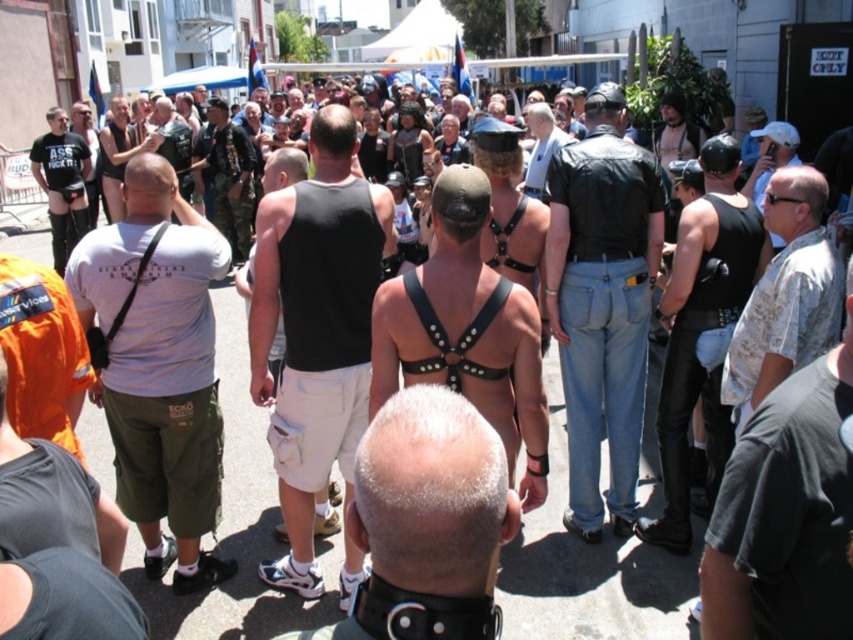
Question: Is gray cotton t-shirt at center bigger than camouflage jacket at center?

Choices:
 (A) yes
 (B) no

Answer: (B)

Question: Which is farther from the black matte tank top at center?

Choices:
 (A) leather harness at center
 (B) camouflage jacket at center

Answer: (B)

Question: Is white cotton t-shirt at center closer to the viewer compared to white textured shirt at center?

Choices:
 (A) no
 (B) yes

Answer: (A)

Question: Which object is the closest to the leather harness at center?

Choices:
 (A) leather jacket at center
 (B) gray cotton t-shirt at center
 (C) white cotton t-shirt at center

Answer: (A)

Question: Is gray cotton t-shirt at center positioned behind camouflage jacket at center?

Choices:
 (A) yes
 (B) no

Answer: (B)

Question: Which object is positioned closest to the white matte shorts at center?

Choices:
 (A) matte black t-shirt at left
 (B) leather harness at center
 (C) leather jacket at center

Answer: (B)